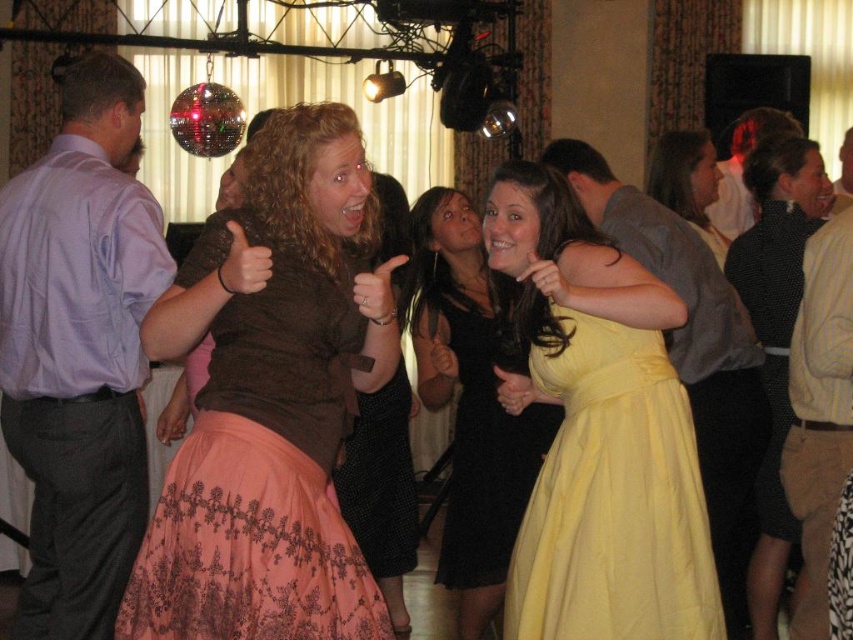
Measure the distance between point (x=773, y=433) and camera.

Point (x=773, y=433) is 4.37 meters away from camera.

Consider the image. Who is shorter, light brown leather pants at right or brown fuzzy sweater at center?

brown fuzzy sweater at center

Who is more forward, [769,564] or [410,564]?

Point [769,564] is in front.

Image resolution: width=853 pixels, height=640 pixels. What are the coordinates of `light brown leather pants at right` in the screenshot? It's located at (775, 330).

Who is more forward, (x=222, y=458) or (x=747, y=212)?

Positioned in front is point (x=222, y=458).

Does matte brown blouse at center have a larger size compared to light brown hair at upper right?

Yes.

Find the location of a particular element. matte brown blouse at center is located at coordinates (271, 401).

Consider the image. Does beige cotton shirt at right have a greater width compared to light brown hair at upper right?

No.

Which is above, beige cotton shirt at right or light brown hair at upper right?

light brown hair at upper right is above.

Between point (824, 472) and point (718, 186), which one is positioned behind?

The point (718, 186) is more distant.

The image size is (853, 640). I want to click on beige cotton shirt at right, so click(x=819, y=412).